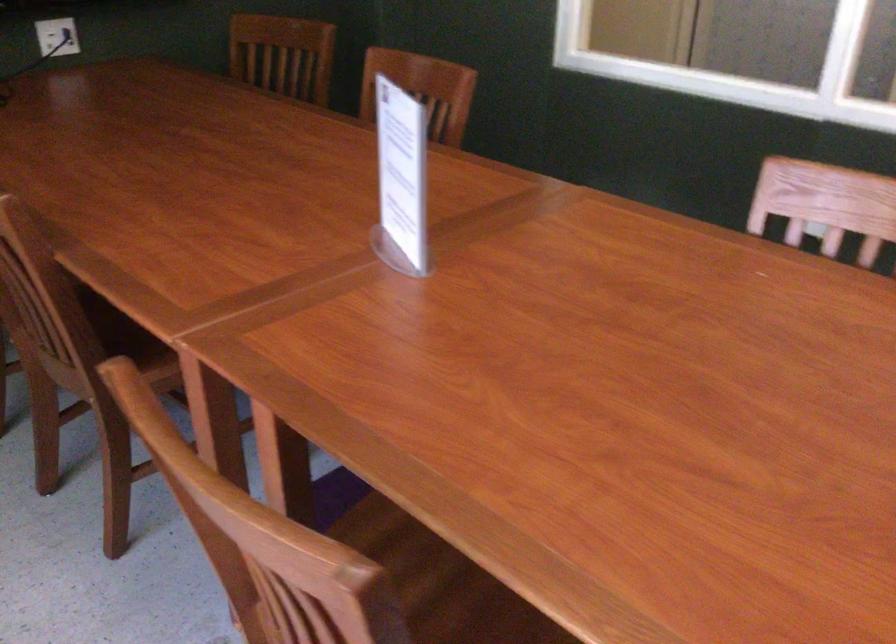
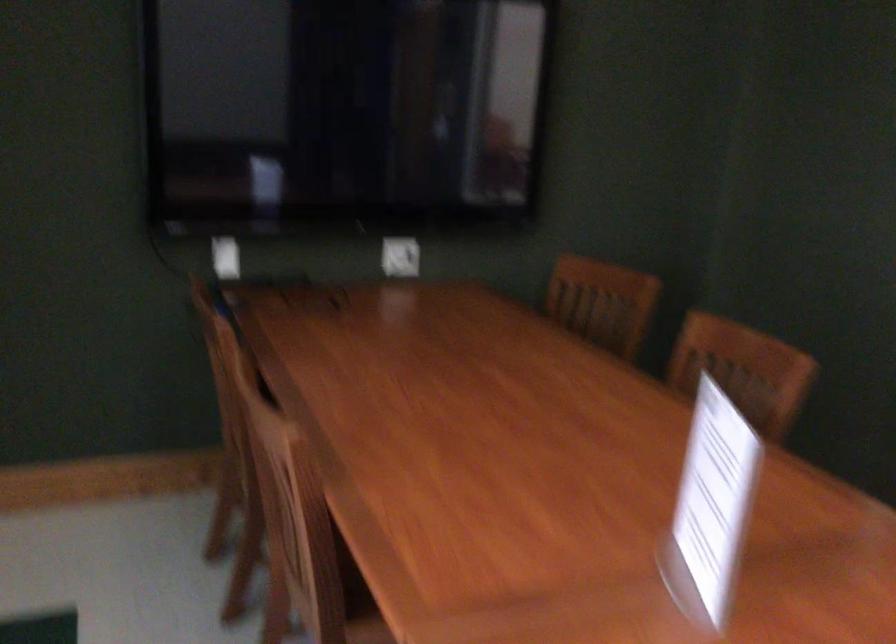
Question: How did the camera likely rotate?

Choices:
 (A) Left
 (B) Right
 (C) Up
 (D) Down

Answer: (A)